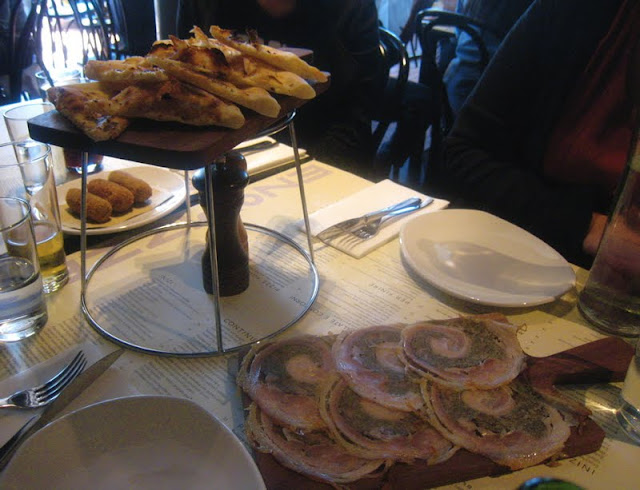
I want to click on plate, so click(x=452, y=221), click(x=187, y=416), click(x=171, y=204).